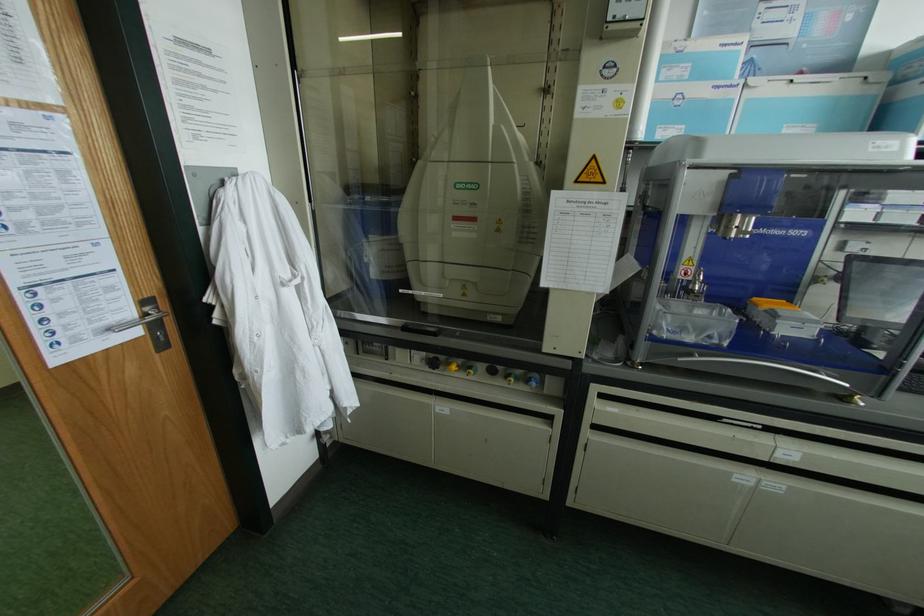
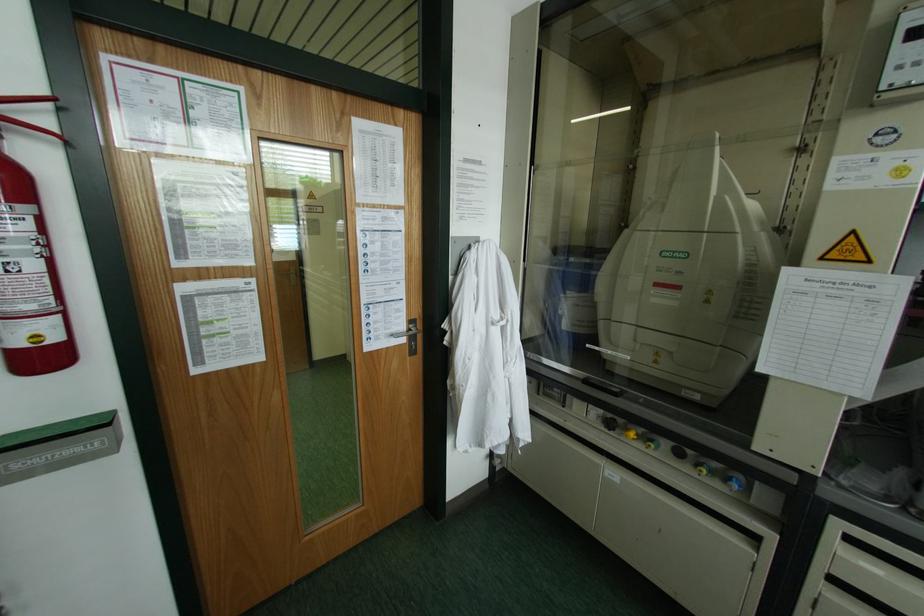
Find the pixel in the second image that matches [211,307] in the first image.

(444, 331)